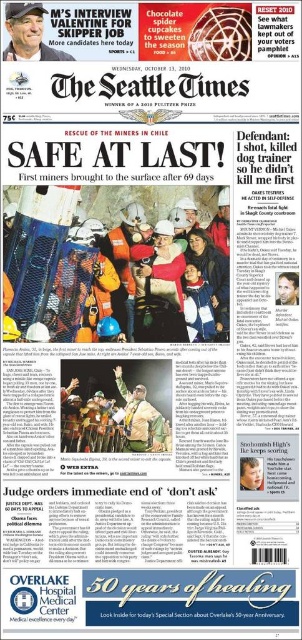
You are a photographer standing at the camera position. You want to take a closeup shot of the matte black cap at upper left. Can you reach it without moving the camera? The newspaper page has a scale where 1 inch equals 2 feet in real life. The distance from the camera to the cap is shown as 4 inches on the scale. Is the actual distance within your camera lens focus range if your lens can focus as close as 5 feet?

The distance between matte black cap at upper left and the camera is 7.89 feet. Since the camera lens can focus as close as 5 feet, the 7.89 feet distance is beyond the minimum focus distance of 5 feet. Therefore, the photographer cannot take a closeup shot without moving the camera.

Looking at the front page of The Seattle Times from October 13, 2010, you notice the hard hat helmet at center and the matte black cap at upper left. Which of these two items is taller?

The hard hat helmet at center is taller than the matte black cap at upper left.

Based on the newspaper front page, which object is positioned higher in the image, the matte black cap at upper left or the smooth skin face at center right?

The matte black cap at upper left is positioned above the smooth skin at center right, so it is higher in the image.